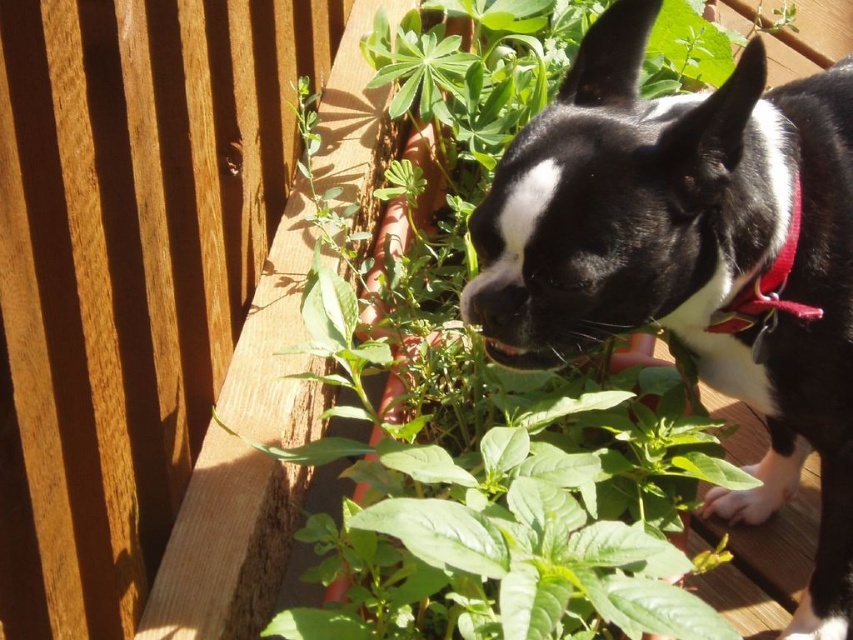
Question: Which object appears closest to the camera in this image?

Choices:
 (A) black matte dog at center
 (B) red fabric neckband at upper right

Answer: (A)

Question: Does black matte dog at center lie in front of red fabric neckband at upper right?

Choices:
 (A) no
 (B) yes

Answer: (B)

Question: Which of the following is the farthest from the observer?

Choices:
 (A) (724, 312)
 (B) (824, 572)

Answer: (B)

Question: Considering the relative positions of black matte dog at center and red fabric neckband at upper right in the image provided, where is black matte dog at center located with respect to red fabric neckband at upper right?

Choices:
 (A) right
 (B) left

Answer: (A)

Question: Does black matte dog at center appear under red fabric neckband at upper right?

Choices:
 (A) no
 (B) yes

Answer: (B)